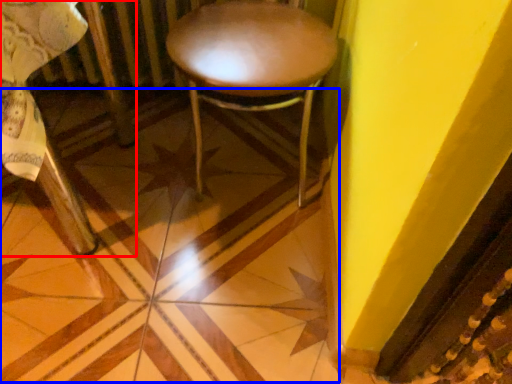
Question: Which of the following is the farthest to the observer, chair (highlighted by a red box) or tile (highlighted by a blue box)?

Choices:
 (A) chair
 (B) tile

Answer: (B)